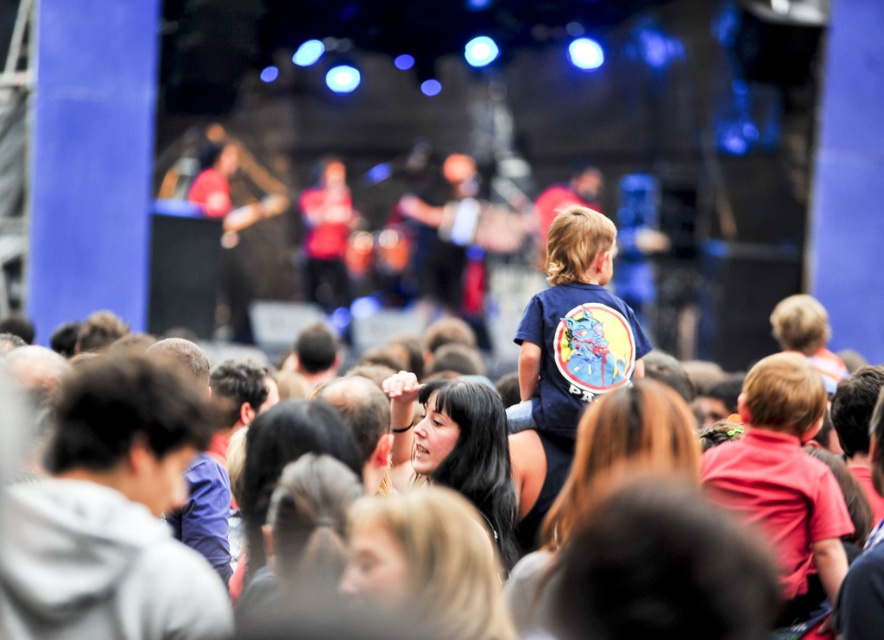
You are a photographer at the concert. You want to take a photo that includes both the gray hoodie at left and the red matte shirt at center. Which of the two should you zoom in on to make them appear the same size in the photo?

To make the gray hoodie at left and the red matte shirt at center appear the same size in the photo, you should zoom in on the gray hoodie at left since it is smaller than the red matte shirt at center.

You are standing at the center of the concert venue and see two points in the image, point [37,481] and point [713,449]. Which point is nearer to you?

Point [37,481] is closer to the viewer than point [713,449].